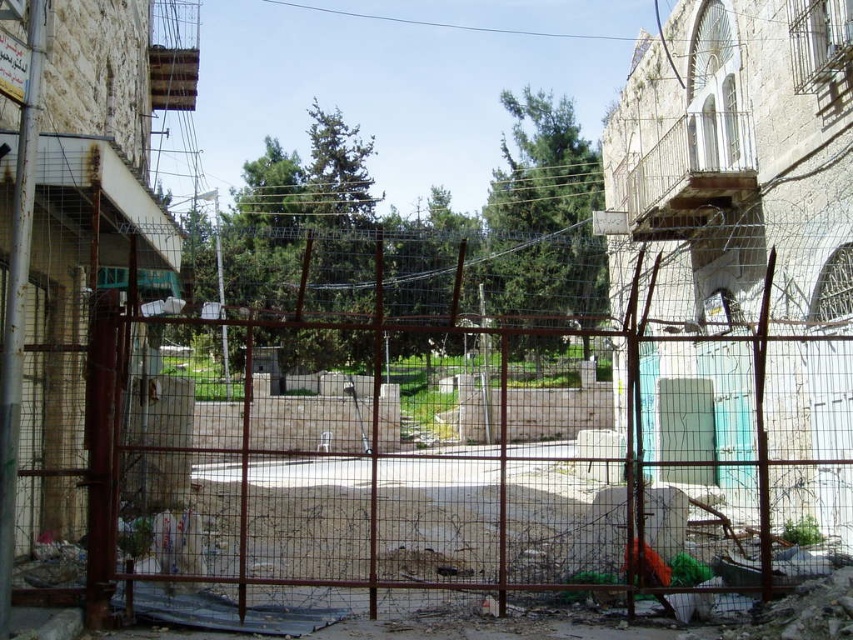
Question: Which of the following is the closest to the observer?

Choices:
 (A) rusty metal fence at center
 (B) transparent plastic door at center

Answer: (A)

Question: Which object appears closest to the camera in this image?

Choices:
 (A) rusty metal fence at center
 (B) transparent plastic door at center

Answer: (A)

Question: Which object appears closest to the camera in this image?

Choices:
 (A) transparent plastic door at center
 (B) rusty metal fence at center

Answer: (B)

Question: Is rusty metal fence at center to the left of transparent plastic door at center from the viewer's perspective?

Choices:
 (A) no
 (B) yes

Answer: (B)

Question: Can you confirm if rusty metal fence at center is positioned below transparent plastic door at center?

Choices:
 (A) no
 (B) yes

Answer: (A)

Question: Does rusty metal fence at center appear over transparent plastic door at center?

Choices:
 (A) yes
 (B) no

Answer: (A)